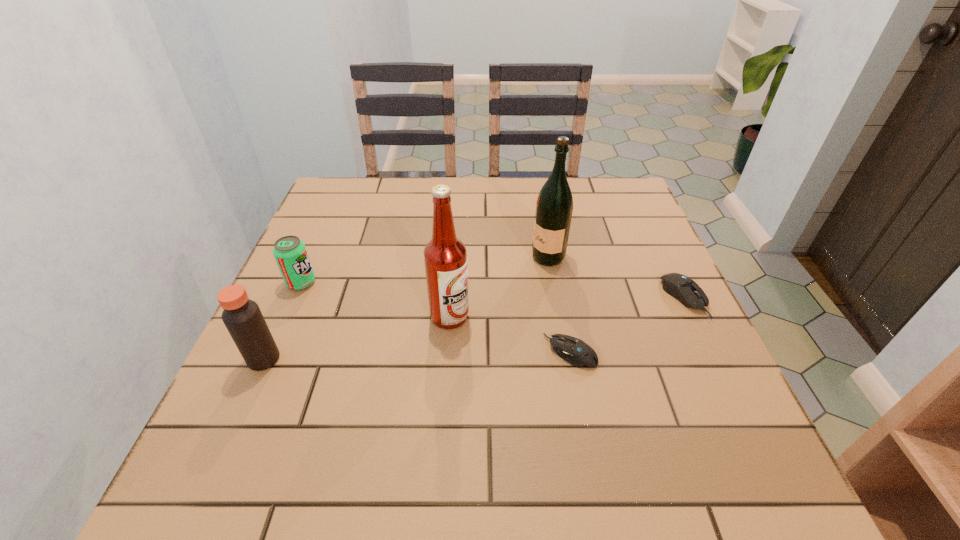
Where is `the nearer computer mouse`? The height and width of the screenshot is (540, 960). the nearer computer mouse is located at coordinates (575, 351).

Locate an element on the screen. the shortest object is located at coordinates (575, 351).

Image resolution: width=960 pixels, height=540 pixels. What are the coordinates of `the rightmost object` in the screenshot? It's located at (684, 289).

The width and height of the screenshot is (960, 540). In order to click on the fifth tallest object in this screenshot , I will do `click(684, 289)`.

Find the location of a particular element. The width and height of the screenshot is (960, 540). the third shortest object is located at coordinates 290,253.

I want to click on vinegar, so click(242, 317).

Locate an element on the screen. The image size is (960, 540). alcohol is located at coordinates (445, 256).

This screenshot has width=960, height=540. I want to click on the farthest object, so click(x=554, y=206).

Identify the location of free region located 0.130m on the back of the shortest object. (559, 292).

Locate an element on the screen. The height and width of the screenshot is (540, 960). free space located 0.120m on the back of the right computer mouse is located at coordinates (660, 246).